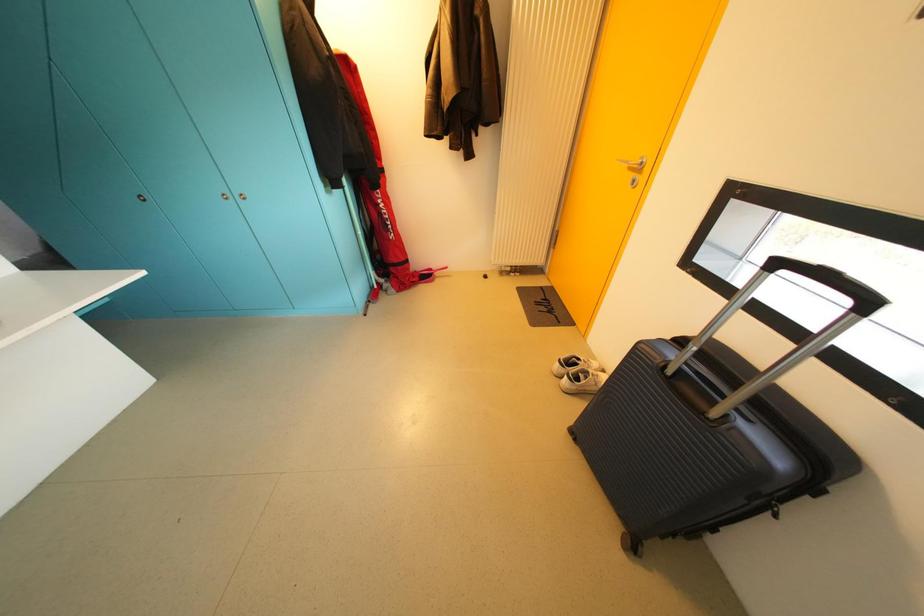
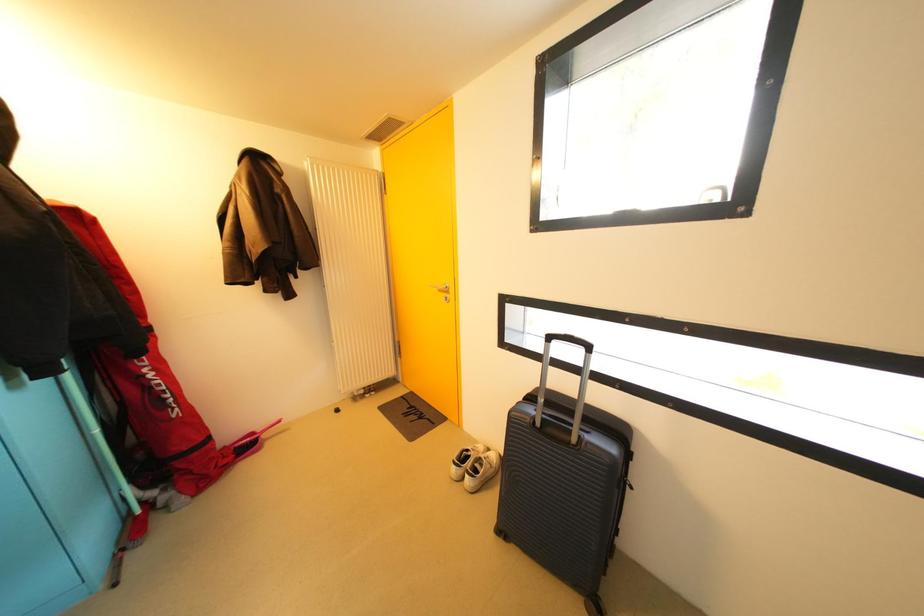
First-person continuous shooting, in which direction is the camera rotating?

The rotation direction of the camera is right-up.